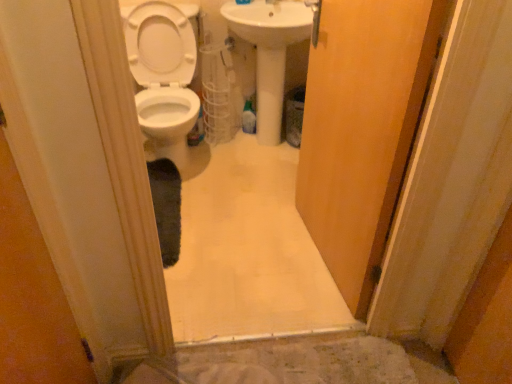
Where is `vacant space underneath white glossy sink at center (from a real-world perspective)`? The height and width of the screenshot is (384, 512). vacant space underneath white glossy sink at center (from a real-world perspective) is located at coordinates (273, 148).